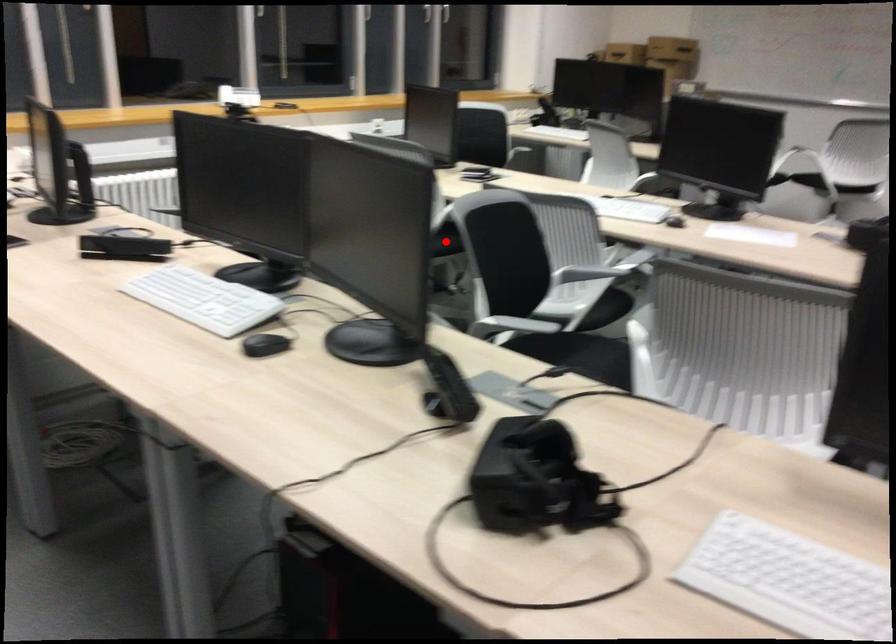
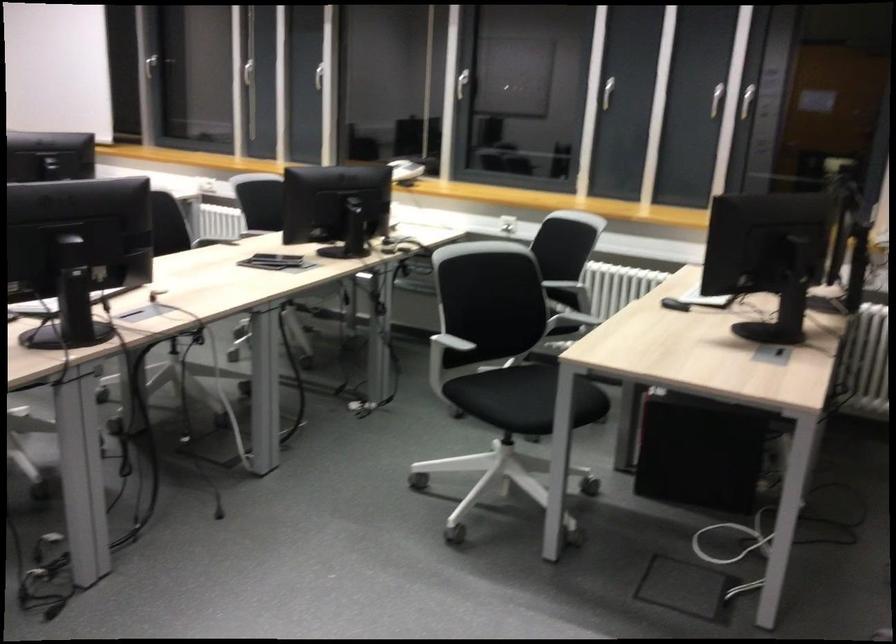
Question: I am providing you with two images of the same scene from different viewpoints. A red point is marked on the first image. Is the red point's position out of view in image 2?

Choices:
 (A) Yes
 (B) No

Answer: (A)